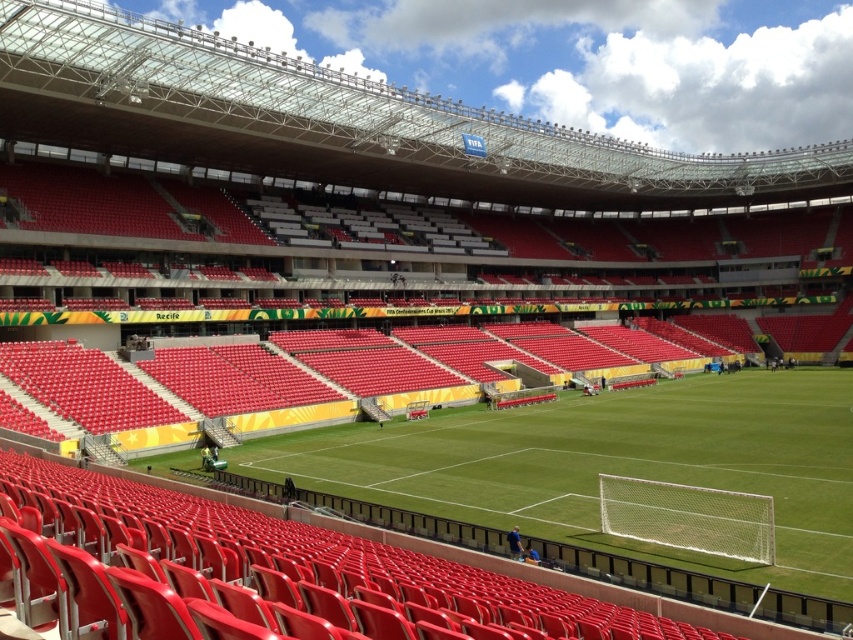
Does point (589, 540) come in front of point (692, 518)?

Yes.

What do you see at coordinates (610, 465) in the screenshot? I see `green grass football field at center` at bounding box center [610, 465].

This screenshot has width=853, height=640. What are the coordinates of `green grass football field at center` in the screenshot? It's located at (610, 465).

Is white mesh net at lower right shorter than metallic silver cart at center?

Yes, white mesh net at lower right is shorter than metallic silver cart at center.

Is white mesh net at lower right thinner than metallic silver cart at center?

Yes, white mesh net at lower right is thinner than metallic silver cart at center.

Is point (668, 484) positioned in front of point (424, 400)?

That is True.

Image resolution: width=853 pixels, height=640 pixels. What are the coordinates of `white mesh net at lower right` in the screenshot? It's located at (688, 516).

Describe the element at coordinates (610, 465) in the screenshot. The image size is (853, 640). I see `green grass football field at center` at that location.

Between green grass football field at center and metallic silver cart at center, which one is positioned lower?

Positioned lower is green grass football field at center.

The height and width of the screenshot is (640, 853). I want to click on green grass football field at center, so coord(610,465).